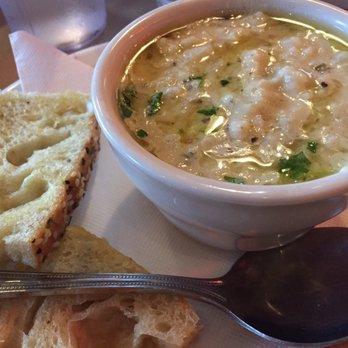
Image resolution: width=348 pixels, height=348 pixels. I want to click on napkin, so click(130, 219), click(53, 71).